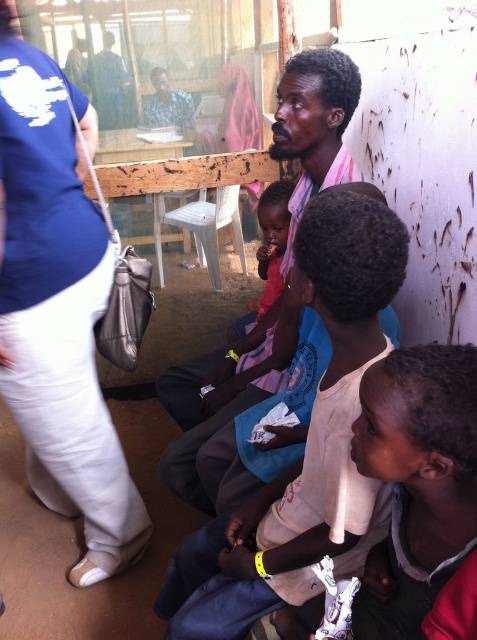
Question: Which point is closer to the camera?

Choices:
 (A) pink fabric at center
 (B) blue fabric shirt at left
 (C) white cotton shirt at lower right

Answer: (C)

Question: In this image, where is light brown cotton shirt at center located relative to pink fabric at center?

Choices:
 (A) right
 (B) left

Answer: (A)

Question: Does blue fabric shirt at left have a greater width compared to light brown cotton shirt at center?

Choices:
 (A) no
 (B) yes

Answer: (A)

Question: Is light brown cotton shirt at center thinner than white cotton shirt at lower right?

Choices:
 (A) yes
 (B) no

Answer: (B)

Question: Which object appears farthest from the camera in this image?

Choices:
 (A) white cotton shirt at lower right
 (B) pink fabric at center
 (C) light brown cotton shirt at center
 (D) blue fabric shirt at left

Answer: (B)

Question: Among these objects, which one is farthest from the camera?

Choices:
 (A) white cotton shirt at lower right
 (B) light brown cotton shirt at center
 (C) pink fabric at center
 (D) blue fabric shirt at left

Answer: (C)